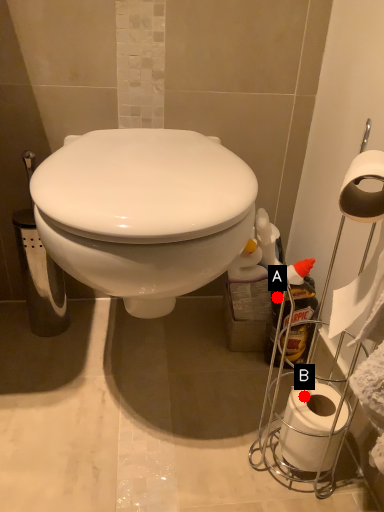
Question: Two points are circled on the image, labeled by A and B beside each circle. Which point is farther to the camera?

Choices:
 (A) A is further
 (B) B is further

Answer: (A)